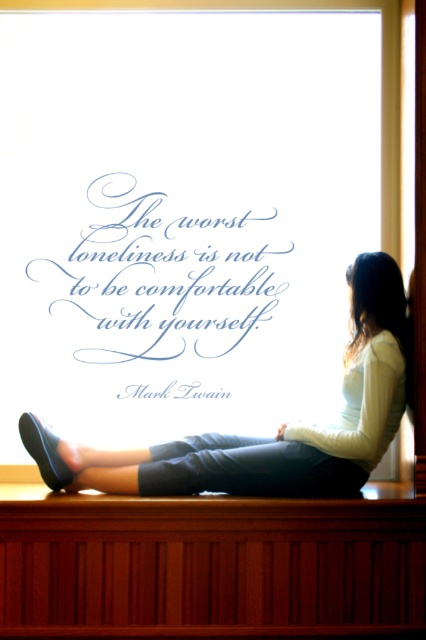
Question: In this image, where is wooden ledge at lower center located relative to light beige sweater at lower right?

Choices:
 (A) below
 (B) above

Answer: (A)

Question: Which object appears closest to the camera in this image?

Choices:
 (A) light beige sweater at lower right
 (B) wooden ledge at lower center

Answer: (B)

Question: Among these objects, which one is nearest to the camera?

Choices:
 (A) wooden ledge at lower center
 (B) light beige sweater at lower right

Answer: (A)

Question: Does wooden ledge at lower center have a larger size compared to light beige sweater at lower right?

Choices:
 (A) no
 (B) yes

Answer: (A)

Question: Can you confirm if wooden ledge at lower center is bigger than light beige sweater at lower right?

Choices:
 (A) no
 (B) yes

Answer: (A)